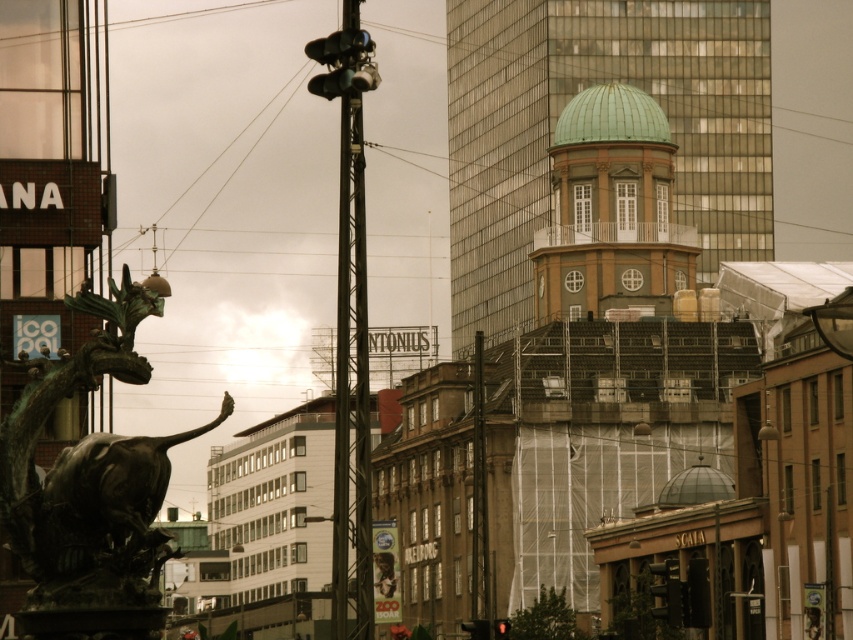
In the scene shown: You are standing in the urban scene and want to place a new bench between the two points labeled as point (x=19, y=513) and point (x=645, y=230). Which point should the bench be closer to if you want it to be near the foreground?

The bench should be placed closer to point (x=19, y=513) because it is closer to the viewer than point (x=645, y=230).

You are a drone operator who needs to fly a drone from the green patina bronze bull at lower left to the green glass dome at upper center. Based on the scene, will the drone have a clear path to reach the dome without obstacles?

The green glass dome at upper center is further to the viewer than the green patina bronze bull at lower left, so the drone will have a clear path to reach the dome since it is positioned behind the bull and not obstructed by it.